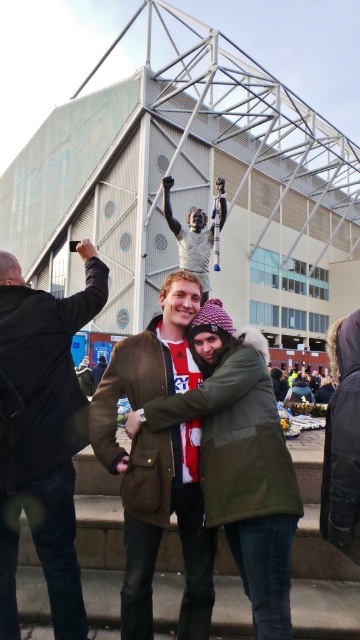
You are at the stadium entrance and see two jackets in the scene. Which jacket is positioned higher up, the dark brown leather jacket at upper left or the brown suede jacket at center?

The dark brown leather jacket at upper left is located above the brown suede jacket at center.

You are a photographer at the stadium event and want to ensure all jackets are visible in the photo. Given that the brown suede jacket at center is behind the dark brown leather jacket at upper left, which jacket should you adjust to avoid blocking the view?

To ensure all jackets are visible, you should move the brown suede jacket at center forward since it is currently behind the dark brown leather jacket at upper left and might be obstructed.